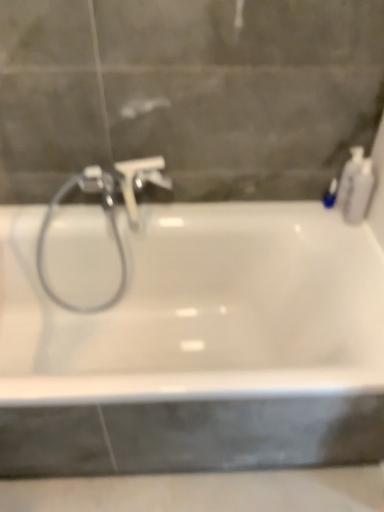
Question: Should I look upward or downward to see white glossy bathtub at center?

Choices:
 (A) up
 (B) down

Answer: (B)

Question: From a real-world perspective, is satin nickel faucet at upper left under satin nickel faucet at center?

Choices:
 (A) yes
 (B) no

Answer: (A)

Question: Considering the relative positions of satin nickel faucet at upper left and satin nickel faucet at center in the image provided, is satin nickel faucet at upper left behind satin nickel faucet at center?

Choices:
 (A) yes
 (B) no

Answer: (A)

Question: Can you confirm if satin nickel faucet at upper left is positioned to the right of satin nickel faucet at center?

Choices:
 (A) no
 (B) yes

Answer: (A)

Question: From the image's perspective, is satin nickel faucet at upper left beneath satin nickel faucet at center?

Choices:
 (A) yes
 (B) no

Answer: (A)

Question: Considering the relative sizes of satin nickel faucet at upper left and satin nickel faucet at center in the image provided, is satin nickel faucet at upper left wider than satin nickel faucet at center?

Choices:
 (A) yes
 (B) no

Answer: (B)

Question: Is satin nickel faucet at upper left beside satin nickel faucet at center?

Choices:
 (A) no
 (B) yes

Answer: (B)

Question: Would you say white glossy bathtub at center is outside satin nickel faucet at upper left?

Choices:
 (A) no
 (B) yes

Answer: (B)

Question: Can you confirm if white glossy bathtub at center is taller than satin nickel faucet at upper left?

Choices:
 (A) no
 (B) yes

Answer: (A)

Question: From a real-world perspective, is white glossy bathtub at center on top of satin nickel faucet at upper left?

Choices:
 (A) yes
 (B) no

Answer: (B)

Question: Considering the relative sizes of white glossy bathtub at center and satin nickel faucet at upper left in the image provided, is white glossy bathtub at center thinner than satin nickel faucet at upper left?

Choices:
 (A) yes
 (B) no

Answer: (B)

Question: Can you confirm if white glossy bathtub at center is shorter than satin nickel faucet at upper left?

Choices:
 (A) yes
 (B) no

Answer: (A)

Question: From a real-world perspective, is white glossy bathtub at center positioned under satin nickel faucet at upper left based on gravity?

Choices:
 (A) yes
 (B) no

Answer: (A)

Question: Does blue glossy bottle at upper right, the 3th toiletry from the right, appear on the left side of white plastic soap dispenser at upper right, the 2th toiletry in the right-to-left sequence?

Choices:
 (A) yes
 (B) no

Answer: (A)